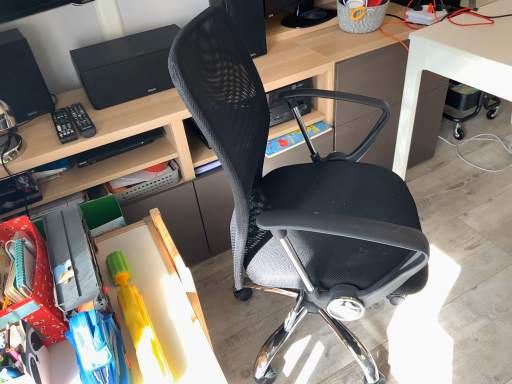
This screenshot has height=384, width=512. What do you see at coordinates (248, 22) in the screenshot?
I see `black mesh speaker at upper center, the first loudspeaker in the right-to-left sequence` at bounding box center [248, 22].

I want to click on matte plastic book at center, so click(283, 143).

Measure the distance between point (423, 42) and camera.

The depth of point (423, 42) is 1.38 meters.

The width and height of the screenshot is (512, 384). Describe the element at coordinates (162, 300) in the screenshot. I see `wooden toy at lower left, positioned as the first desk in left-to-right order` at that location.

The width and height of the screenshot is (512, 384). What do you see at coordinates (22, 78) in the screenshot? I see `black matte speaker at upper left, placed as the 2th loudspeaker when sorted from right to left` at bounding box center [22, 78].

The height and width of the screenshot is (384, 512). In order to click on black matte printer at upper left in this screenshot , I will do `click(125, 67)`.

The height and width of the screenshot is (384, 512). I want to click on black mesh speaker at upper center, the first loudspeaker in the right-to-left sequence, so (x=248, y=22).

Consider the image. How much distance is there between black mesh chair at center, which ranks as the second desk in right-to-left order, and white glossy desk at lower right, which ranks as the 1th desk in right-to-left order?

black mesh chair at center, which ranks as the second desk in right-to-left order, is 7.39 inches away from white glossy desk at lower right, which ranks as the 1th desk in right-to-left order.

From a real-world perspective, which object rests below the other?

white glossy desk at lower right, which ranks as the 1th desk in right-to-left order, from a real-world perspective.

Choose the correct answer: Is black mesh chair at center, placed as the second desk when sorted from left to right, inside white glossy desk at lower right, acting as the 3th desk starting from the left, or outside it?

black mesh chair at center, placed as the second desk when sorted from left to right, is not enclosed by white glossy desk at lower right, acting as the 3th desk starting from the left.

Does black mesh chair at center, which ranks as the second desk in right-to-left order, have a smaller size compared to white glossy desk at lower right, acting as the 3th desk starting from the left?

No, black mesh chair at center, which ranks as the second desk in right-to-left order, is not smaller than white glossy desk at lower right, acting as the 3th desk starting from the left.

I want to click on the 1st remote control behind the black matte speaker at upper left, the first loudspeaker when ordered from left to right, so click(64, 125).

Is black matte speaker at upper left, the first loudspeaker when ordered from left to right, facing towards black plastic remote control at left, which is the first remote control from left to right?

Yes, black matte speaker at upper left, the first loudspeaker when ordered from left to right, is aimed at black plastic remote control at left, which is the first remote control from left to right.

Does black matte speaker at upper left, placed as the 2th loudspeaker when sorted from right to left, contain black plastic remote control at left, which is the first remote control from left to right?

Definitely not — black plastic remote control at left, which is the first remote control from left to right, is not inside black matte speaker at upper left, placed as the 2th loudspeaker when sorted from right to left.

From the image's perspective, is black matte speaker at upper left, placed as the 2th loudspeaker when sorted from right to left, located above or below black plastic remote control at left, which is counted as the second remote control, starting from the right?

Based on their image positions, black matte speaker at upper left, placed as the 2th loudspeaker when sorted from right to left, is located above black plastic remote control at left, which is counted as the second remote control, starting from the right.

Is black plastic remote control at left, which is counted as the first remote control, starting from the right, surrounded by black mesh office chair at center?

No.

Could you tell me if black mesh office chair at center is facing black plastic remote control at left, marked as the second remote control in a left-to-right arrangement?

No.

Are black mesh office chair at center and black plastic remote control at left, which is counted as the first remote control, starting from the right, far apart?

black mesh office chair at center is actually quite close to black plastic remote control at left, which is counted as the first remote control, starting from the right.

From a real-world perspective, is black mesh office chair at center positioned over black plastic remote control at left, which is counted as the first remote control, starting from the right, based on gravity?

Actually, black mesh office chair at center is physically below black plastic remote control at left, which is counted as the first remote control, starting from the right, in the real world.

Based on the photo, could you tell me if wooden toy at lower left, acting as the 3th desk starting from the right, is turned towards white glossy desk at lower right, which ranks as the 1th desk in right-to-left order?

No, wooden toy at lower left, acting as the 3th desk starting from the right, is not facing towards white glossy desk at lower right, which ranks as the 1th desk in right-to-left order.

From a real-world perspective, which object stands above the other?

From a 3D spatial view, white glossy desk at lower right, which ranks as the 1th desk in right-to-left order, is above.

In the image, is wooden toy at lower left, positioned as the first desk in left-to-right order, on the left side or the right side of white glossy desk at lower right, which ranks as the 1th desk in right-to-left order?

Based on their positions, wooden toy at lower left, positioned as the first desk in left-to-right order, is located to the left of white glossy desk at lower right, which ranks as the 1th desk in right-to-left order.

From the image's perspective, who appears lower, wooden toy at lower left, positioned as the first desk in left-to-right order, or white glossy desk at lower right, acting as the 3th desk starting from the left?

wooden toy at lower left, positioned as the first desk in left-to-right order, from the image's perspective.

Consider the image. Is rubber yellow toy at lower left facing away from matte plastic book at center?

rubber yellow toy at lower left does not have its back to matte plastic book at center.

Would you consider rubber yellow toy at lower left to be distant from matte plastic book at center?

No, rubber yellow toy at lower left is in close proximity to matte plastic book at center.

Find the location of `book on the right of rubber yellow toy at lower left`. book on the right of rubber yellow toy at lower left is located at coordinates (283, 143).

How distant is rubber yellow toy at lower left from matte plastic book at center?

rubber yellow toy at lower left is 30.97 inches from matte plastic book at center.

Could you measure the distance between black plastic remote control at left, marked as the second remote control in a left-to-right arrangement, and black mesh chair at center, which ranks as the second desk in right-to-left order?

The distance of black plastic remote control at left, marked as the second remote control in a left-to-right arrangement, from black mesh chair at center, which ranks as the second desk in right-to-left order, is 32.96 inches.

Image resolution: width=512 pixels, height=384 pixels. In order to click on desk that is the 2nd object to the right of the black plastic remote control at left, marked as the second remote control in a left-to-right arrangement, starting at the anchor in this screenshot , I will do `click(112, 141)`.

Are black plastic remote control at left, marked as the second remote control in a left-to-right arrangement, and black mesh chair at center, placed as the second desk when sorted from left to right, making contact?

No, black plastic remote control at left, marked as the second remote control in a left-to-right arrangement, is not touching black mesh chair at center, placed as the second desk when sorted from left to right.

In the scene shown: Which point is more forward, (80, 130) or (153, 158)?

The point (80, 130) is more forward.

From a real-world perspective, which object stands above the other?

From a 3D spatial view, black matte speaker at upper left, the first loudspeaker when ordered from left to right, is above.

Does black mesh chair at center, placed as the second desk when sorted from left to right, lie in front of black matte speaker at upper left, the first loudspeaker when ordered from left to right?

Yes, black mesh chair at center, placed as the second desk when sorted from left to right, is in front of black matte speaker at upper left, the first loudspeaker when ordered from left to right.

Which object is wider, black mesh chair at center, which ranks as the second desk in right-to-left order, or black matte speaker at upper left, placed as the 2th loudspeaker when sorted from right to left?

black mesh chair at center, which ranks as the second desk in right-to-left order.

Does point (103, 139) come closer to viewer compared to point (34, 98)?

Yes, point (103, 139) is in front of point (34, 98).

What are the coordinates of `desk that appears behind the black mesh chair at center, which ranks as the second desk in right-to-left order` in the screenshot? It's located at (454, 68).

Find the location of a particular element. the 2nd remote control below when counting from the black matte speaker at upper left, the first loudspeaker when ordered from left to right (from the image's perspective) is located at coordinates (64, 125).

Looking at the image, which one is located closer to black plastic remote control at left, which is counted as the second remote control, starting from the right, black mesh office chair at center or black plastic remote control at left, which is counted as the first remote control, starting from the right?

Based on the image, black plastic remote control at left, which is counted as the first remote control, starting from the right, appears to be nearer to black plastic remote control at left, which is counted as the second remote control, starting from the right.

From the image, which object appears to be farther from black matte printer at upper left, black matte speaker at upper left, the first loudspeaker when ordered from left to right, or black mesh speaker at upper center, the first loudspeaker in the right-to-left sequence?

black mesh speaker at upper center, the first loudspeaker in the right-to-left sequence.

In the scene shown: Which object lies nearer to the anchor point black matte speaker at upper left, placed as the 2th loudspeaker when sorted from right to left, black matte printer at upper left or matte plastic book at center?

The object closer to black matte speaker at upper left, placed as the 2th loudspeaker when sorted from right to left, is black matte printer at upper left.

Based on their spatial positions, is black plastic remote control at left, which is counted as the first remote control, starting from the right, or black mesh office chair at center further from black mesh speaker at upper center, the first loudspeaker in the right-to-left sequence?

The object further to black mesh speaker at upper center, the first loudspeaker in the right-to-left sequence, is black plastic remote control at left, which is counted as the first remote control, starting from the right.

Consider the image. Based on their spatial positions, is black plastic remote control at left, which is the first remote control from left to right, or black mesh speaker at upper center, marked as the 2th loudspeaker in a left-to-right arrangement, closer to matte plastic book at center?

black mesh speaker at upper center, marked as the 2th loudspeaker in a left-to-right arrangement, lies closer to matte plastic book at center than the other object.

Looking at the image, which one is located closer to white glossy desk at lower right, which ranks as the 1th desk in right-to-left order, matte plastic book at center or black mesh office chair at center?

Based on the image, matte plastic book at center appears to be nearer to white glossy desk at lower right, which ranks as the 1th desk in right-to-left order.

Consider the image. From the image, which object appears to be farther from rubber yellow toy at lower left, matte plastic book at center or black mesh office chair at center?

matte plastic book at center is positioned further to the anchor rubber yellow toy at lower left.

Based on their spatial positions, is black mesh chair at center, placed as the second desk when sorted from left to right, or wooden toy at lower left, acting as the 3th desk starting from the right, further from matte plastic book at center?

Based on the image, wooden toy at lower left, acting as the 3th desk starting from the right, appears to be further to matte plastic book at center.

At what (x,y) coordinates should I click in order to perform the action: click on remote control located between black plastic remote control at left, which is counted as the second remote control, starting from the right, and black mesh office chair at center in the left-right direction. Please return your answer as a coordinate pair (x, y). The image size is (512, 384). Looking at the image, I should click on (81, 120).

At what (x,y) coordinates should I click in order to perform the action: click on printer between black mesh speaker at upper center, the first loudspeaker in the right-to-left sequence, and rubber yellow toy at lower left, in the vertical direction. Please return your answer as a coordinate pair (x, y). This screenshot has width=512, height=384. Looking at the image, I should click on (125, 67).

Identify the location of printer between black matte speaker at upper left, placed as the 2th loudspeaker when sorted from right to left, and matte plastic book at center. (125, 67).

This screenshot has width=512, height=384. What are the coordinates of `loudspeaker between black plastic remote control at left, marked as the second remote control in a left-to-right arrangement, and white glossy desk at lower right, which ranks as the 1th desk in right-to-left order, from left to right` in the screenshot? It's located at (248, 22).